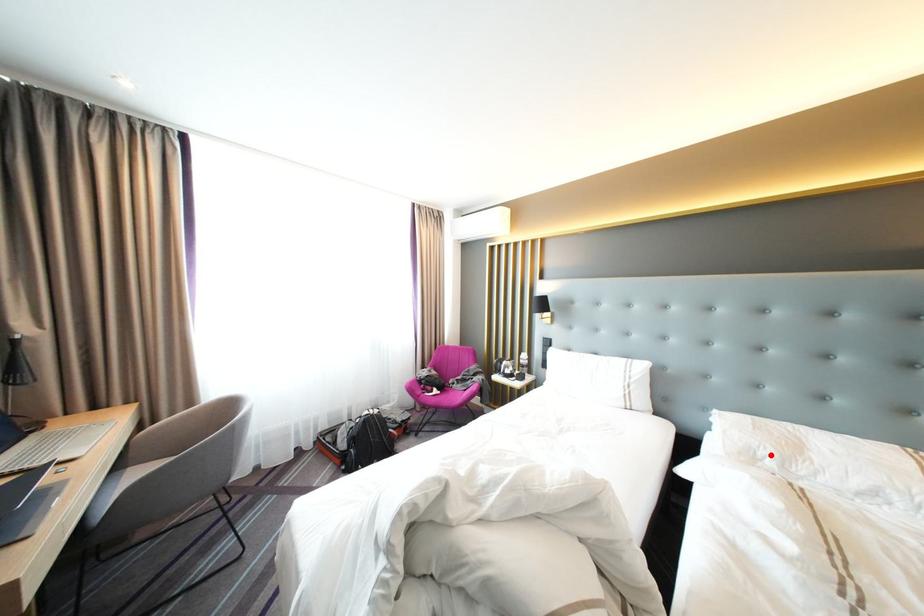
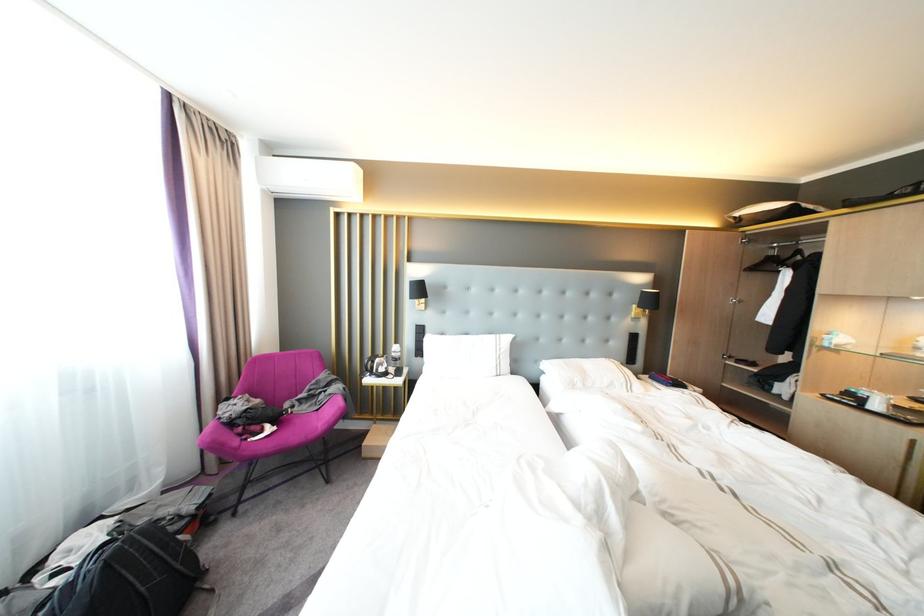
Find the pixel in the second image that matches the highlighted location in the first image.

(586, 382)